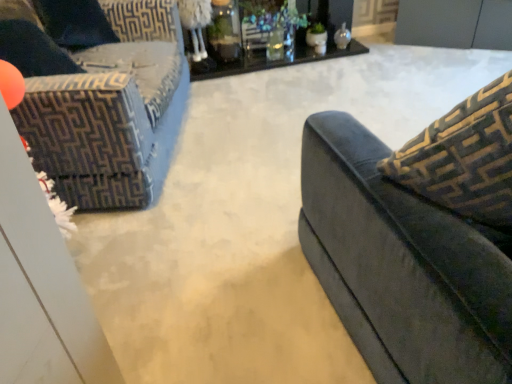
What is the approximate width of black glass table at upper center?

black glass table at upper center is 16.51 inches wide.

You are a GUI agent. You are given a task and a screenshot of the screen. Output one action in this format:
    pyautogui.click(x=<x>, y=<y>)
    Task: Click on the black glass table at upper center
    This screenshot has height=384, width=512.
    Given the screenshot: What is the action you would take?
    pyautogui.click(x=270, y=60)

What do you see at coordinates (270, 60) in the screenshot?
I see `black glass table at upper center` at bounding box center [270, 60].

The image size is (512, 384). What are the coordinates of `velvet dark blue couch at left` in the screenshot? It's located at (99, 94).

Measure the distance between velvet dark blue couch at left and camera.

The distance of velvet dark blue couch at left from camera is 1.49 meters.

The image size is (512, 384). What do you see at coordinates (99, 94) in the screenshot?
I see `velvet dark blue couch at left` at bounding box center [99, 94].

Locate an element on the screen. The height and width of the screenshot is (384, 512). black glass table at upper center is located at coordinates (270, 60).

Which object is positioned more to the right, velvet dark blue couch at left or black glass table at upper center?

black glass table at upper center.

In the image, is velvet dark blue couch at left positioned in front of or behind black glass table at upper center?

velvet dark blue couch at left is in front of black glass table at upper center.

Is point (64, 143) positioned before point (321, 58)?

Yes, point (64, 143) is in front of point (321, 58).

From the image's perspective, would you say velvet dark blue couch at left is shown under black glass table at upper center?

Indeed, from the image's perspective, velvet dark blue couch at left is shown beneath black glass table at upper center.

From a real-world perspective, is velvet dark blue couch at left physically below black glass table at upper center?

Incorrect, from a real-world perspective, velvet dark blue couch at left is higher than black glass table at upper center.

Considering the sizes of objects velvet dark blue couch at left and black glass table at upper center in the image provided, who is thinner, velvet dark blue couch at left or black glass table at upper center?

black glass table at upper center.

Considering the relative sizes of velvet dark blue couch at left and black glass table at upper center in the image provided, is velvet dark blue couch at left shorter than black glass table at upper center?

Incorrect, the height of velvet dark blue couch at left does not fall short of that of black glass table at upper center.

Considering the sizes of objects velvet dark blue couch at left and black glass table at upper center in the image provided, who is bigger, velvet dark blue couch at left or black glass table at upper center?

Bigger between the two is velvet dark blue couch at left.

Is black glass table at upper center inside velvet dark blue couch at left?

That's incorrect, black glass table at upper center is not inside velvet dark blue couch at left.

Does velvet dark blue couch at left touch black glass table at upper center?

No, velvet dark blue couch at left is not touching black glass table at upper center.

Is black glass table at upper center at the back of velvet dark blue couch at left?

That's not correct — velvet dark blue couch at left is not looking away from black glass table at upper center.

Can you tell me how much velvet dark blue couch at left and black glass table at upper center differ in facing direction?

velvet dark blue couch at left and black glass table at upper center are facing 73.8 degrees away from each other.

Find the location of `studio couch that is on the left side of black glass table at upper center`. studio couch that is on the left side of black glass table at upper center is located at coordinates coord(99,94).

Between black glass table at upper center and velvet dark blue couch at left, which one appears on the right side from the viewer's perspective?

From the viewer's perspective, black glass table at upper center appears more on the right side.

Which is in front, black glass table at upper center or velvet dark blue couch at left?

velvet dark blue couch at left.

Which is less distant, (322,59) or (58,137)?

Positioned in front is point (58,137).

From the image's perspective, is black glass table at upper center below velvet dark blue couch at left?

No.

From a real-world perspective, who is located lower, black glass table at upper center or velvet dark blue couch at left?

From a 3D spatial view, black glass table at upper center is below.

Is black glass table at upper center wider than velvet dark blue couch at left?

Incorrect, the width of black glass table at upper center does not surpass that of velvet dark blue couch at left.

Which of these two, black glass table at upper center or velvet dark blue couch at left, stands shorter?

black glass table at upper center.

Between black glass table at upper center and velvet dark blue couch at left, which one has larger size?

Bigger between the two is velvet dark blue couch at left.

Would you say black glass table at upper center is inside or outside velvet dark blue couch at left?

black glass table at upper center lies outside velvet dark blue couch at left.

Is black glass table at upper center not close to velvet dark blue couch at left?

Yes.

Is black glass table at upper center aimed at velvet dark blue couch at left?

No, black glass table at upper center does not turn towards velvet dark blue couch at left.

Can you tell me how much black glass table at upper center and velvet dark blue couch at left differ in facing direction?

The angle between the facing direction of black glass table at upper center and the facing direction of velvet dark blue couch at left is 73.8 degrees.

Where is `studio couch that appears on the left of black glass table at upper center`? This screenshot has height=384, width=512. studio couch that appears on the left of black glass table at upper center is located at coordinates (99, 94).

In order to click on table that is above the velvet dark blue couch at left (from the image's perspective) in this screenshot , I will do `click(270, 60)`.

Identify the location of studio couch lying below the black glass table at upper center (from the image's perspective). This screenshot has width=512, height=384. (99, 94).